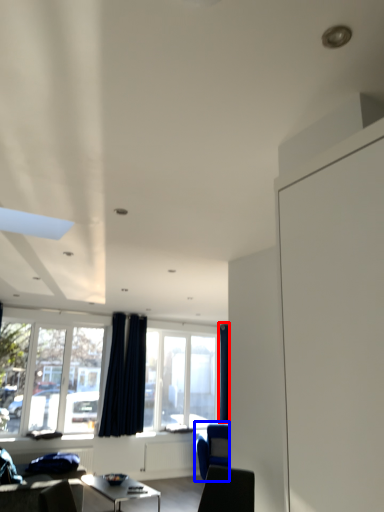
Question: Which object appears closest to the camera in this image, curtain (highlighted by a red box) or armchair (highlighted by a blue box)?

Choices:
 (A) curtain
 (B) armchair

Answer: (B)